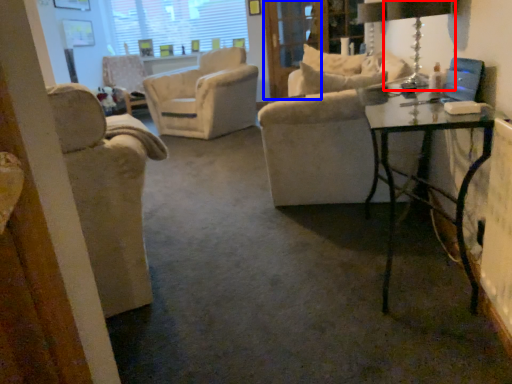
Question: Which point is closer to the camera, table lamp (highlighted by a red box) or screen door (highlighted by a blue box)?

Choices:
 (A) table lamp
 (B) screen door

Answer: (A)